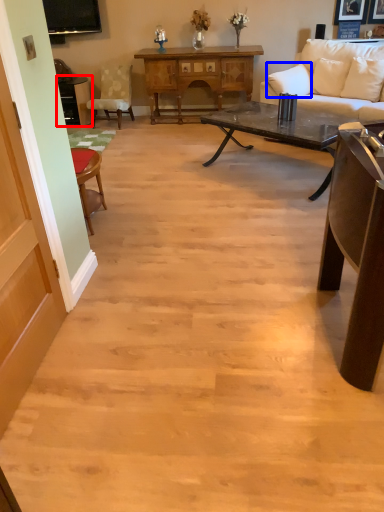
Question: Which of the following is the farthest to the observer, table (highlighted by a red box) or pillow (highlighted by a blue box)?

Choices:
 (A) table
 (B) pillow

Answer: (A)